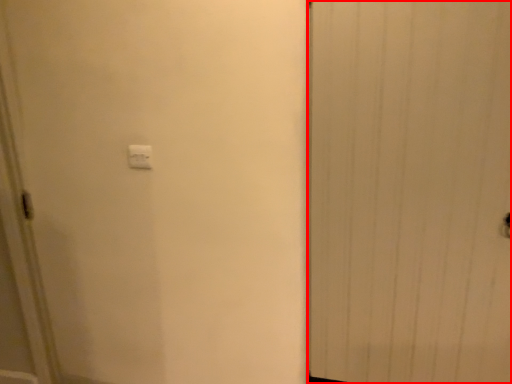
Question: Where is door (annotated by the red box) located in relation to light switch in the image?

Choices:
 (A) right
 (B) left

Answer: (A)